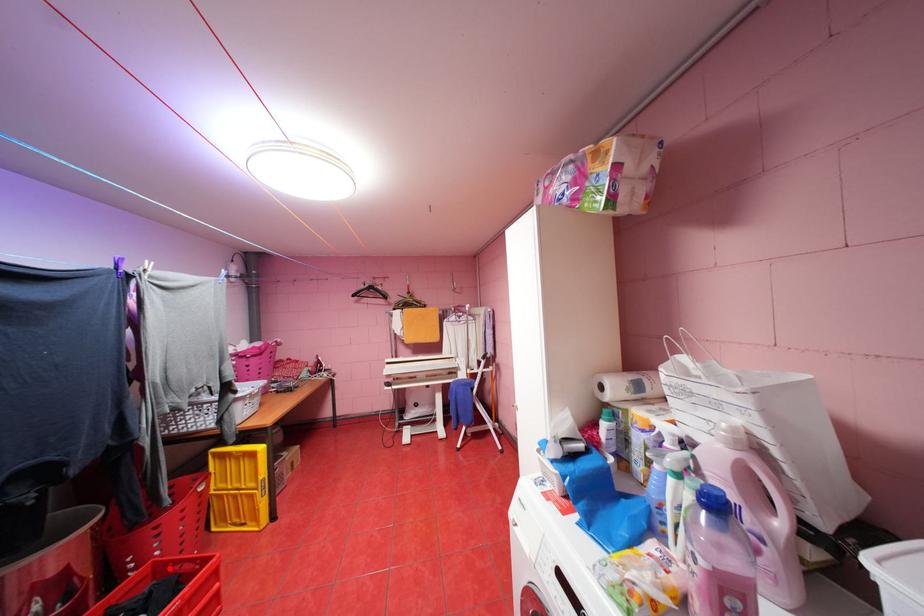
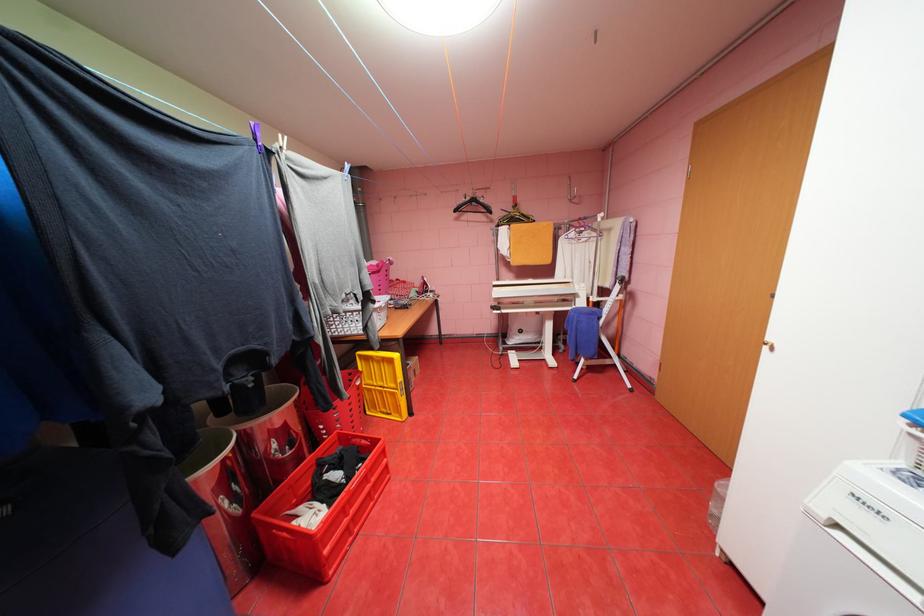
Question: I am providing you with two images of the same scene from different viewpoints. In image1, a red point is highlighted. Considering the same 3D point in image2, which of the following is correct?

Choices:
 (A) It is closer
 (B) It is farther

Answer: (A)